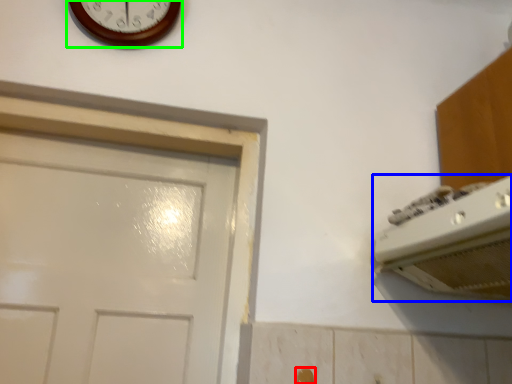
Question: Considering the real-world distances, which object is closest to door handle (highlighted by a red box)? appliance (highlighted by a blue box) or wall clock (highlighted by a green box).

Choices:
 (A) appliance
 (B) wall clock

Answer: (A)